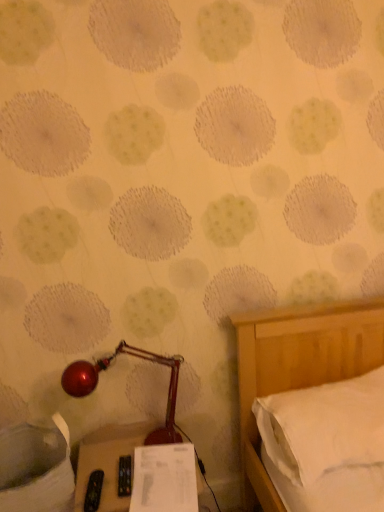
Question: Does white soft pillow at right appear on the left side of shiny red lamp at lower left?

Choices:
 (A) yes
 (B) no

Answer: (B)

Question: Can you confirm if white soft pillow at right is bigger than shiny red lamp at lower left?

Choices:
 (A) yes
 (B) no

Answer: (A)

Question: Does white soft pillow at right have a lesser height compared to shiny red lamp at lower left?

Choices:
 (A) no
 (B) yes

Answer: (B)

Question: Are white soft pillow at right and shiny red lamp at lower left beside each other?

Choices:
 (A) yes
 (B) no

Answer: (B)

Question: Can you confirm if white soft pillow at right is thinner than shiny red lamp at lower left?

Choices:
 (A) yes
 (B) no

Answer: (B)

Question: Considering their positions, is white paper at lower center located in front of or behind shiny red lamp at lower left?

Choices:
 (A) behind
 (B) front

Answer: (B)

Question: In terms of size, does white paper at lower center appear bigger or smaller than shiny red lamp at lower left?

Choices:
 (A) small
 (B) big

Answer: (A)

Question: From the image's perspective, is white paper at lower center above or below shiny red lamp at lower left?

Choices:
 (A) below
 (B) above

Answer: (A)

Question: Is white paper at lower center situated inside shiny red lamp at lower left or outside?

Choices:
 (A) outside
 (B) inside

Answer: (A)

Question: From the image's perspective, relative to white soft pillow at right, is black plastic remote control at lower center above or below?

Choices:
 (A) below
 (B) above

Answer: (A)

Question: Is black plastic remote control at lower center in front of or behind white soft pillow at right in the image?

Choices:
 (A) front
 (B) behind

Answer: (A)

Question: Does point (102, 435) appear closer or farther from the camera than point (284, 448)?

Choices:
 (A) closer
 (B) farther

Answer: (B)

Question: Is black plastic remote control at lower center situated inside white soft pillow at right or outside?

Choices:
 (A) outside
 (B) inside

Answer: (A)

Question: Based on their sizes in the image, would you say white soft pillow at right is bigger or smaller than white paper at lower center?

Choices:
 (A) big
 (B) small

Answer: (A)

Question: Is white soft pillow at right in front of or behind white paper at lower center in the image?

Choices:
 (A) front
 (B) behind

Answer: (B)